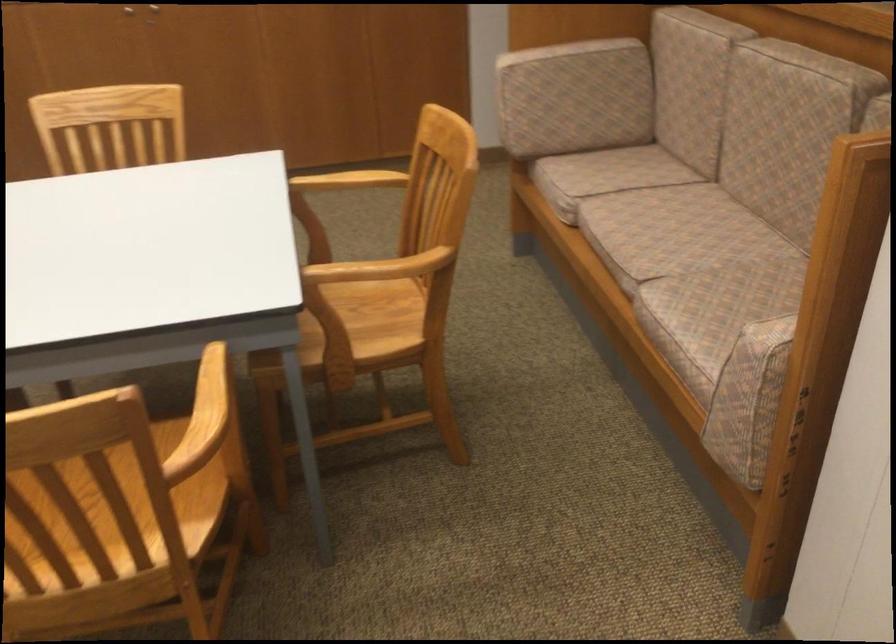
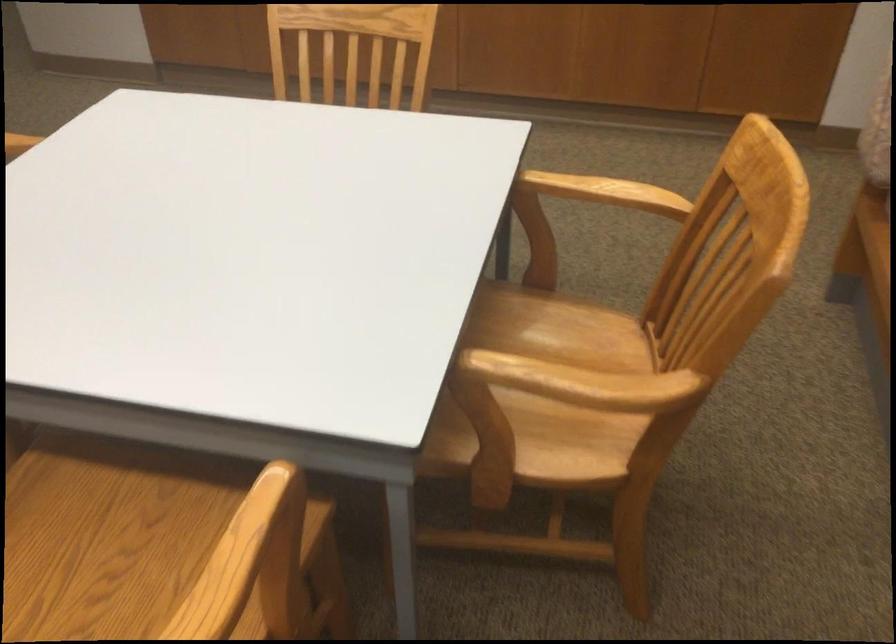
Where in the second image is the point corresponding to point 354,279 from the first image?

(567, 330)